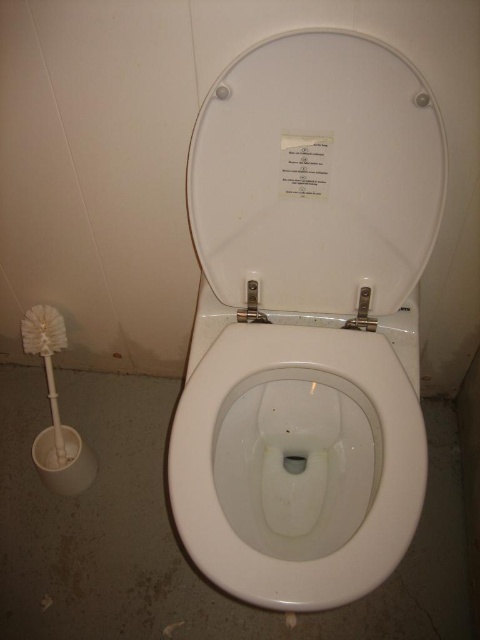
In the scene shown: You are a bathroom cleaner with a 24 inch mop. You need to clean the area between the white glossy toilet lid at center and the toilet brush holder on the left. Can your mop reach the entire space between them?

The distance between the white glossy toilet lid at center and the toilet brush holder on the left is 25.35 inches. Since your mop is only 24 inches long, it cannot fully reach the entire space between them.

You are standing in a bathroom and want to close the white glossy toilet lid at center. Based on its position, where should you aim to press to close it?

The white glossy toilet lid at center is located at point (328,173), so you should aim to press that specific coordinate to close it.

You are a bathroom cleaner and need to determine which tool to use first. Since the white glossy toilet at center is larger than the white plastic toilet brush at left, which object should you clean first according to standard cleaning protocols?

According to standard cleaning protocols, you should clean the smaller object first to avoid contaminating larger surfaces. Therefore, you should clean the white plastic toilet brush at left before moving on to the white glossy toilet at center.